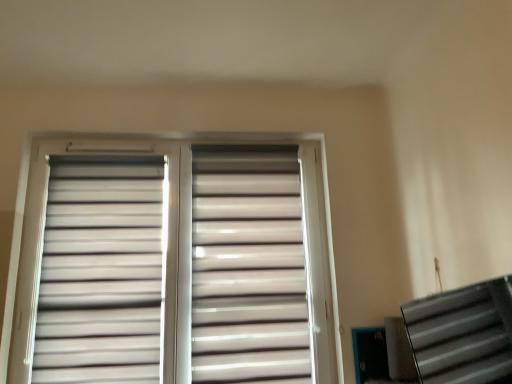
Question: Is metallic silver stairwell at lower right surrounding matte white shutter at center, which is counted as the 2th shutter, starting from the left?

Choices:
 (A) no
 (B) yes

Answer: (A)

Question: From a real-world perspective, is metallic silver stairwell at lower right below matte white shutter at center, which appears as the first shutter when viewed from the right?

Choices:
 (A) yes
 (B) no

Answer: (A)

Question: Is metallic silver stairwell at lower right positioned beyond the bounds of matte white shutter at center, which appears as the first shutter when viewed from the right?

Choices:
 (A) yes
 (B) no

Answer: (A)

Question: Could you tell me if metallic silver stairwell at lower right is facing matte white shutter at center, which appears as the first shutter when viewed from the right?

Choices:
 (A) yes
 (B) no

Answer: (B)

Question: From the image's perspective, would you say metallic silver stairwell at lower right is positioned over matte white shutter at center, which is counted as the 2th shutter, starting from the left?

Choices:
 (A) no
 (B) yes

Answer: (A)

Question: Do you think matte white shutter at center, which appears as the first shutter when viewed from the right, is within metallic silver stairwell at lower right, or outside of it?

Choices:
 (A) outside
 (B) inside

Answer: (A)

Question: From a real-world perspective, is matte white shutter at center, which appears as the first shutter when viewed from the right, above or below metallic silver stairwell at lower right?

Choices:
 (A) above
 (B) below

Answer: (A)

Question: Considering their positions, is matte white shutter at center, which is counted as the 2th shutter, starting from the left, located in front of or behind metallic silver stairwell at lower right?

Choices:
 (A) front
 (B) behind

Answer: (B)

Question: From the image's perspective, relative to metallic silver stairwell at lower right, is matte white shutter at center, which appears as the first shutter when viewed from the right, above or below?

Choices:
 (A) above
 (B) below

Answer: (A)

Question: Which is correct: matte white blinds at center is inside white matte shutter at upper left, the first shutter viewed from the left, or outside of it?

Choices:
 (A) outside
 (B) inside

Answer: (B)

Question: In terms of size, does matte white blinds at center appear bigger or smaller than white matte shutter at upper left, acting as the 2th shutter starting from the right?

Choices:
 (A) small
 (B) big

Answer: (B)

Question: Would you say matte white blinds at center is to the left or to the right of white matte shutter at upper left, acting as the 2th shutter starting from the right, in the picture?

Choices:
 (A) left
 (B) right

Answer: (B)

Question: Does point (267, 296) appear closer or farther from the camera than point (121, 266)?

Choices:
 (A) farther
 (B) closer

Answer: (A)

Question: From a real-world perspective, relative to matte white blinds at center, is metallic silver stairwell at lower right vertically above or below?

Choices:
 (A) above
 (B) below

Answer: (B)

Question: Is metallic silver stairwell at lower right wider or thinner than matte white blinds at center?

Choices:
 (A) wide
 (B) thin

Answer: (A)